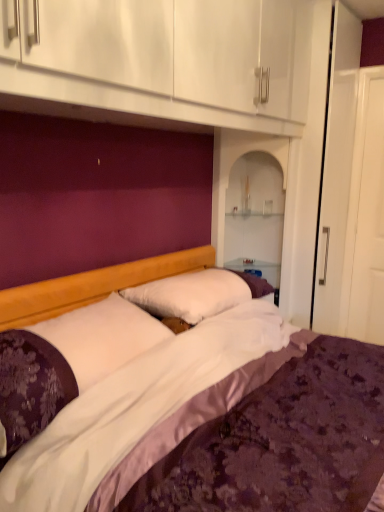
Question: Would you say white satin pillow at center, which is the first pillow from front to back, is a long distance from white soft pillow at center, marked as the first pillow in a back-to-front arrangement?

Choices:
 (A) yes
 (B) no

Answer: (B)

Question: Does white satin pillow at center, which is the first pillow from front to back, have a greater height compared to white soft pillow at center, the 2th pillow when ordered from front to back?

Choices:
 (A) no
 (B) yes

Answer: (B)

Question: Is white satin pillow at center, which is counted as the second pillow, starting from the back, touching white soft pillow at center, the 2th pillow when ordered from front to back?

Choices:
 (A) yes
 (B) no

Answer: (B)

Question: From the image's perspective, is white satin pillow at center, which is counted as the second pillow, starting from the back, on top of white soft pillow at center, the 2th pillow when ordered from front to back?

Choices:
 (A) no
 (B) yes

Answer: (A)

Question: Does white satin pillow at center, which is counted as the second pillow, starting from the back, have a smaller size compared to white soft pillow at center, marked as the first pillow in a back-to-front arrangement?

Choices:
 (A) yes
 (B) no

Answer: (B)

Question: Can you confirm if white satin pillow at center, which is the first pillow from front to back, is thinner than white soft pillow at center, marked as the first pillow in a back-to-front arrangement?

Choices:
 (A) yes
 (B) no

Answer: (B)

Question: Is white satin pillow at center, which is counted as the second pillow, starting from the back, located within white soft pillow at center, the 2th pillow when ordered from front to back?

Choices:
 (A) yes
 (B) no

Answer: (B)

Question: From a real-world perspective, is white soft pillow at center, marked as the first pillow in a back-to-front arrangement, under white satin pillow at center, which is the first pillow from front to back?

Choices:
 (A) yes
 (B) no

Answer: (B)

Question: Does white soft pillow at center, the 2th pillow when ordered from front to back, have a greater height compared to white satin pillow at center, which is counted as the second pillow, starting from the back?

Choices:
 (A) yes
 (B) no

Answer: (B)

Question: Can you confirm if white soft pillow at center, the 2th pillow when ordered from front to back, is positioned to the left of white satin pillow at center, which is the first pillow from front to back?

Choices:
 (A) no
 (B) yes

Answer: (A)

Question: Is white soft pillow at center, the 2th pillow when ordered from front to back, to the right of white satin pillow at center, which is counted as the second pillow, starting from the back, from the viewer's perspective?

Choices:
 (A) no
 (B) yes

Answer: (B)

Question: Does white soft pillow at center, marked as the first pillow in a back-to-front arrangement, have a smaller size compared to white satin pillow at center, which is the first pillow from front to back?

Choices:
 (A) no
 (B) yes

Answer: (B)

Question: Is white soft pillow at center, marked as the first pillow in a back-to-front arrangement, wider or thinner than white satin pillow at center, which is the first pillow from front to back?

Choices:
 (A) thin
 (B) wide

Answer: (A)